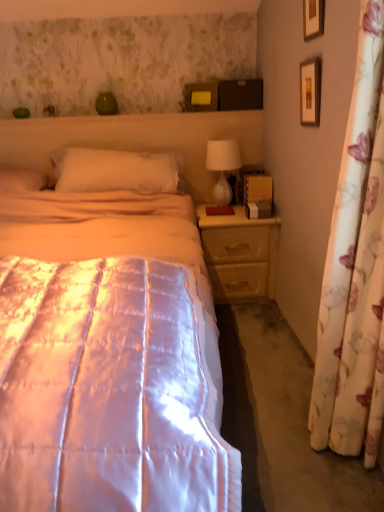
Question: Is white soft pillow at center taller or shorter than white glossy table lamp at upper right?

Choices:
 (A) short
 (B) tall

Answer: (A)

Question: Is point (92, 187) closer or farther from the camera than point (205, 162)?

Choices:
 (A) closer
 (B) farther

Answer: (A)

Question: Considering the real-world distances, which object is closest to the white soft pillow at center?

Choices:
 (A) silky white quilt at center
 (B) wooden picture frame at upper right, the first picture frame in the bottom-to-top sequence
 (C) white glossy table lamp at upper right
 (D) floral fabric curtain at right
 (E) wooden picture frame at upper right, marked as the 1th picture frame in a top-to-bottom arrangement

Answer: (C)

Question: Which object is the closest to the wooden picture frame at upper right, the second picture frame when ordered from top to bottom?

Choices:
 (A) wooden picture frame at upper right, acting as the second picture frame starting from the bottom
 (B) white soft pillow at center
 (C) white glossy table lamp at upper right
 (D) floral fabric curtain at right
 (E) light wood/texture nightstand at right

Answer: (A)